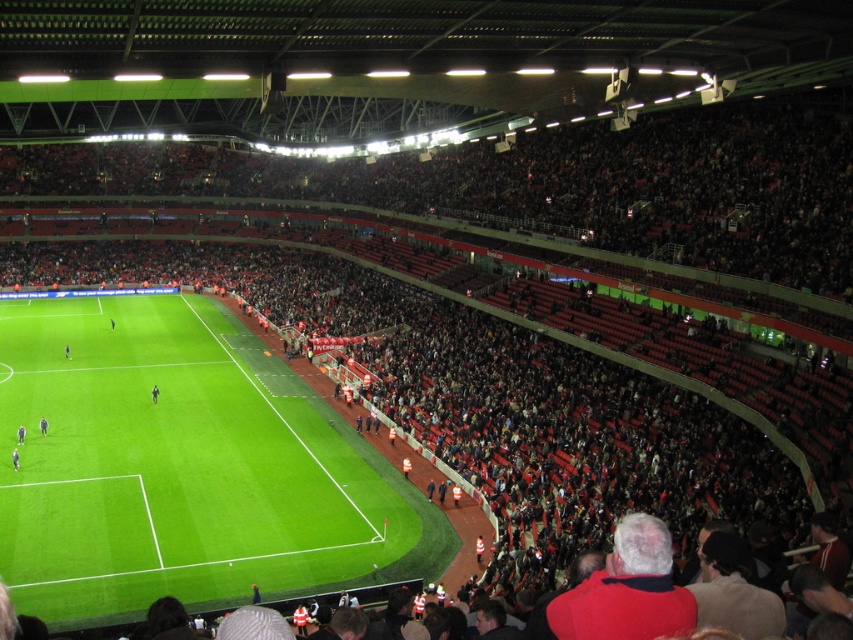
Which of these two, light blue jersey at center or dark gray uniform at center, stands taller?

dark gray uniform at center

Who is more forward, (12, 452) or (151, 394)?

Point (12, 452) is in front.

The height and width of the screenshot is (640, 853). I want to click on light blue jersey at center, so click(15, 460).

Between dark blue jersey at center and dark gray uniform at center, which one has more height?

With more height is dark gray uniform at center.

Can you confirm if dark blue jersey at center is smaller than dark gray uniform at center?

Correct, dark blue jersey at center occupies less space than dark gray uniform at center.

The image size is (853, 640). What are the coordinates of `dark blue jersey at center` in the screenshot? It's located at (44, 426).

Between point (210, 516) and point (152, 394), which one is positioned behind?

The point (152, 394) is behind.

Is green artificial turf at center further to the viewer compared to dark gray uniform at center?

No, green artificial turf at center is closer to the viewer.

This screenshot has height=640, width=853. I want to click on green artificial turf at center, so click(183, 468).